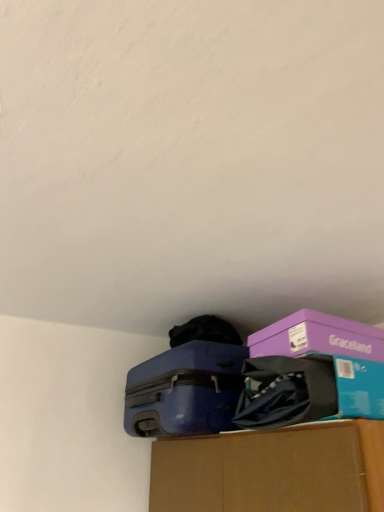
Question: Considering the positions of matte purple storage box at center and matte blue suitcase at center in the image, is matte purple storage box at center wider or thinner than matte blue suitcase at center?

Choices:
 (A) thin
 (B) wide

Answer: (A)

Question: Would you say matte purple storage box at center is inside or outside matte blue suitcase at center?

Choices:
 (A) outside
 (B) inside

Answer: (A)

Question: Which object is positioned closest to the matte purple storage box at center?

Choices:
 (A) purple cardboard box at upper right
 (B) matte blue suitcase at center

Answer: (A)

Question: Considering the real-world distances, which object is closest to the matte purple storage box at center?

Choices:
 (A) purple cardboard box at upper right
 (B) matte blue suitcase at center

Answer: (A)